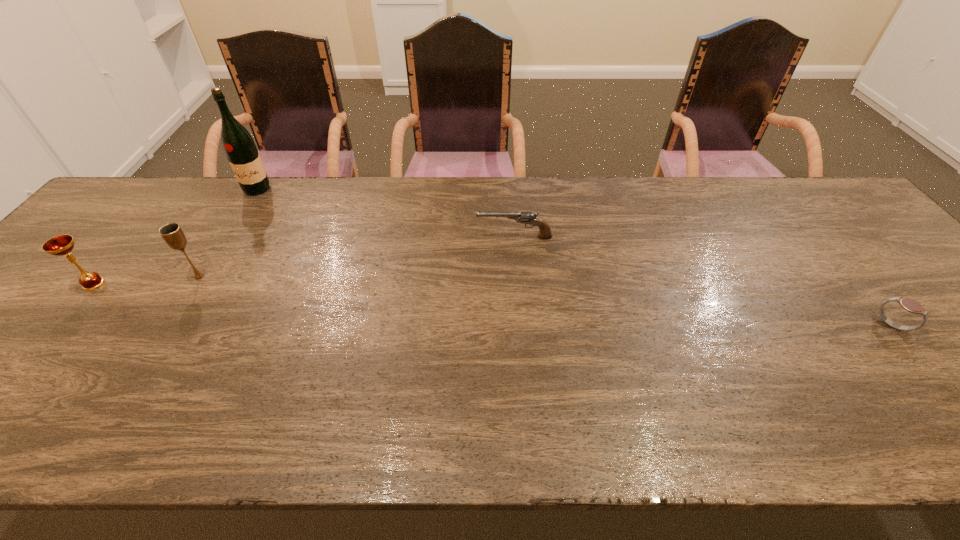
This screenshot has height=540, width=960. What are the coordinates of `vacant space located 0.290m on the front of the right chalice` in the screenshot? It's located at (133, 384).

The image size is (960, 540). Identify the location of free point located on the back of the third shortest object. (165, 199).

Find the location of `free region located 0.380m aiming along the barrel of the fourth nearest object`. free region located 0.380m aiming along the barrel of the fourth nearest object is located at coordinates (341, 237).

This screenshot has height=540, width=960. What are the coordinates of `free space located 0.060m aiming along the barrel of the fourth nearest object` in the screenshot? It's located at (455, 237).

You are a GUI agent. You are given a task and a screenshot of the screen. Output one action in this format:
    pyautogui.click(x=<x>, y=<y>)
    Task: Click on the free region located 0.070m aiming along the barrel of the fourth nearest object
    
    Given the screenshot: What is the action you would take?
    pyautogui.click(x=451, y=237)

Identify the location of free space located on the back of the watch. This screenshot has width=960, height=540. (814, 231).

Locate an element on the screen. object present at the far edge is located at coordinates (239, 147).

The height and width of the screenshot is (540, 960). In order to click on object positioned at the left edge in this screenshot , I will do `click(60, 245)`.

This screenshot has height=540, width=960. Find the location of `object situated at the right edge`. object situated at the right edge is located at coordinates (910, 305).

I want to click on vacant space at the far edge, so click(754, 184).